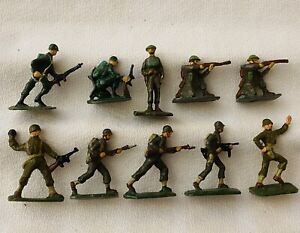
Locate an element on the screen. off-white textured background is located at coordinates (11, 16).